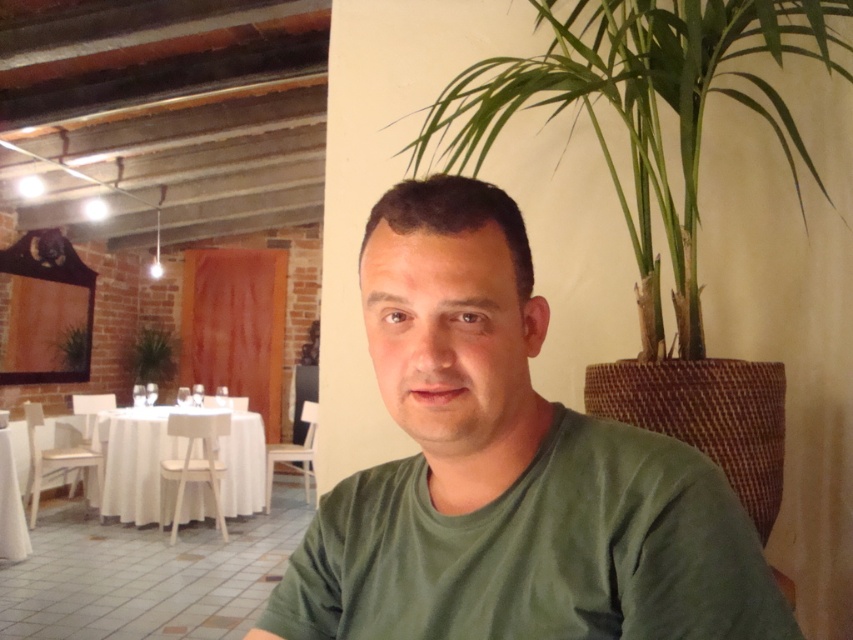
Question: Is green leafy plant at upper right bigger than white fabric table at left?

Choices:
 (A) no
 (B) yes

Answer: (A)

Question: Which point is closer to the camera taking this photo?

Choices:
 (A) (62, 337)
 (B) (172, 337)
 (C) (645, 170)
 (D) (167, 410)

Answer: (C)

Question: Can you confirm if white fabric table at left is positioned above green leafy plant at left?

Choices:
 (A) no
 (B) yes

Answer: (A)

Question: Among these objects, which one is nearest to the camera?

Choices:
 (A) green leafy plant at left
 (B) green leafy plant at center

Answer: (A)

Question: Is green leafy plant at upper right in front of white fabric table at left?

Choices:
 (A) no
 (B) yes

Answer: (B)

Question: Which point is closer to the camera?

Choices:
 (A) [486, 84]
 (B) [209, 493]

Answer: (A)